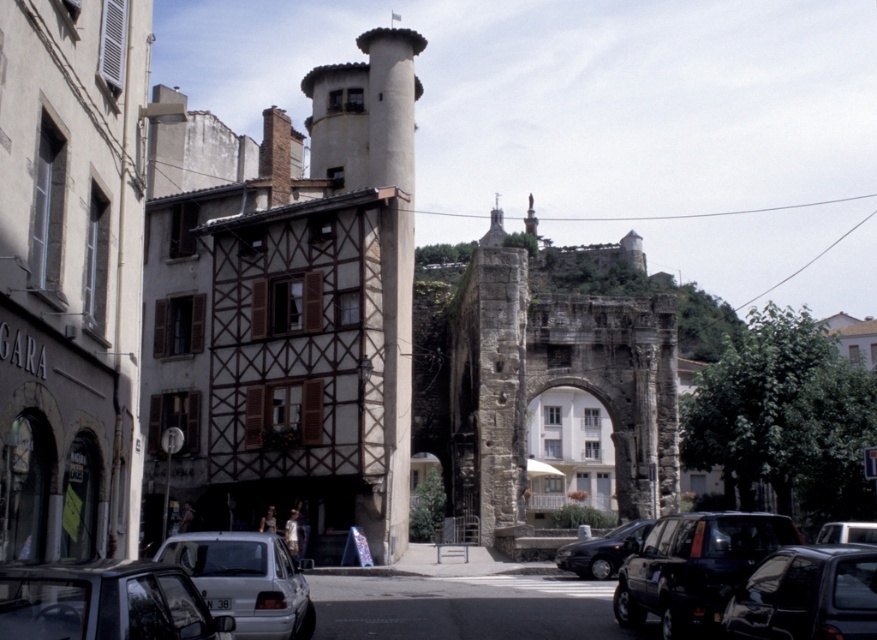
Does silver metallic car at lower left appear over metallic silver car at center?

Yes, silver metallic car at lower left is above metallic silver car at center.

Between silver metallic car at lower left and metallic silver car at center, which one is positioned higher?

silver metallic car at lower left is higher up.

Image resolution: width=877 pixels, height=640 pixels. Describe the element at coordinates (103, 602) in the screenshot. I see `silver metallic car at lower left` at that location.

Locate an element on the screen. silver metallic car at lower left is located at coordinates (103, 602).

Can you confirm if shiny black suv at center is positioned to the right of white matte car at lower left?

Correct, you'll find shiny black suv at center to the right of white matte car at lower left.

Is point (681, 522) farther from camera compared to point (222, 560)?

Yes.

This screenshot has height=640, width=877. What do you see at coordinates (694, 566) in the screenshot?
I see `shiny black suv at center` at bounding box center [694, 566].

At what (x,y) coordinates should I click in order to perform the action: click on shiny black suv at center. Please return your answer as a coordinate pair (x, y). Image resolution: width=877 pixels, height=640 pixels. Looking at the image, I should click on (694, 566).

Where is `silver metallic car at lower left`? The height and width of the screenshot is (640, 877). silver metallic car at lower left is located at coordinates (103, 602).

Does point (38, 627) lie behind point (264, 612)?

No.

Locate an element on the screen. Image resolution: width=877 pixels, height=640 pixels. silver metallic car at lower left is located at coordinates (103, 602).